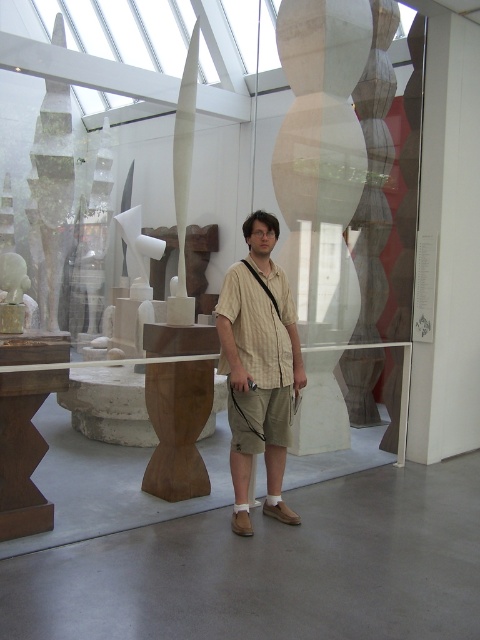
The width and height of the screenshot is (480, 640). Describe the element at coordinates (259, 368) in the screenshot. I see `light beige striped shirt at center` at that location.

Measure the distance between light beige striped shirt at center and camera.

They are 3.32 meters apart.

Find the location of a particular element. This screenshot has width=480, height=640. light beige striped shirt at center is located at coordinates (259, 368).